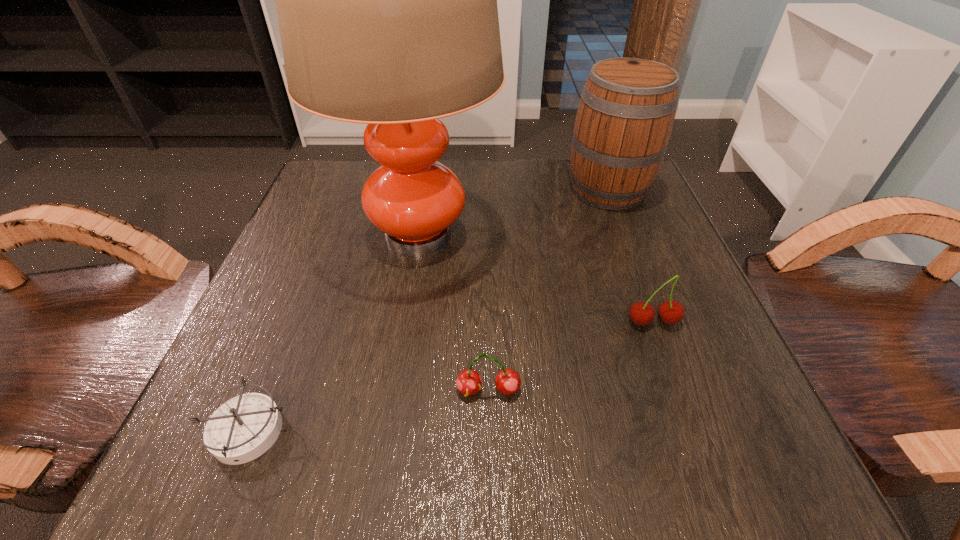
Identify the location of lamp. [x=386, y=0].

Locate an element on the screen. cider is located at coordinates (627, 108).

Where is `the farther cherry`? The image size is (960, 540). the farther cherry is located at coordinates (670, 312).

I want to click on the third farthest object, so click(x=670, y=312).

Where is `the shorter cherry`? Image resolution: width=960 pixels, height=540 pixels. the shorter cherry is located at coordinates (469, 382).

This screenshot has height=540, width=960. What are the coordinates of `the fourth tallest object` in the screenshot? It's located at (469, 382).

Image resolution: width=960 pixels, height=540 pixels. I want to click on compass, so pos(243,428).

What are the coordinates of `free location located 0.200m on the right of the tallest object` in the screenshot? It's located at (602, 234).

At what (x,y) coordinates should I click in order to perform the action: click on free space located 0.180m on the front of the cider. Please return your answer as a coordinate pair (x, y). This screenshot has height=540, width=960. Looking at the image, I should click on pos(640,274).

Find the location of a particular element. vacant space located on the surface of the right cherry is located at coordinates (673, 376).